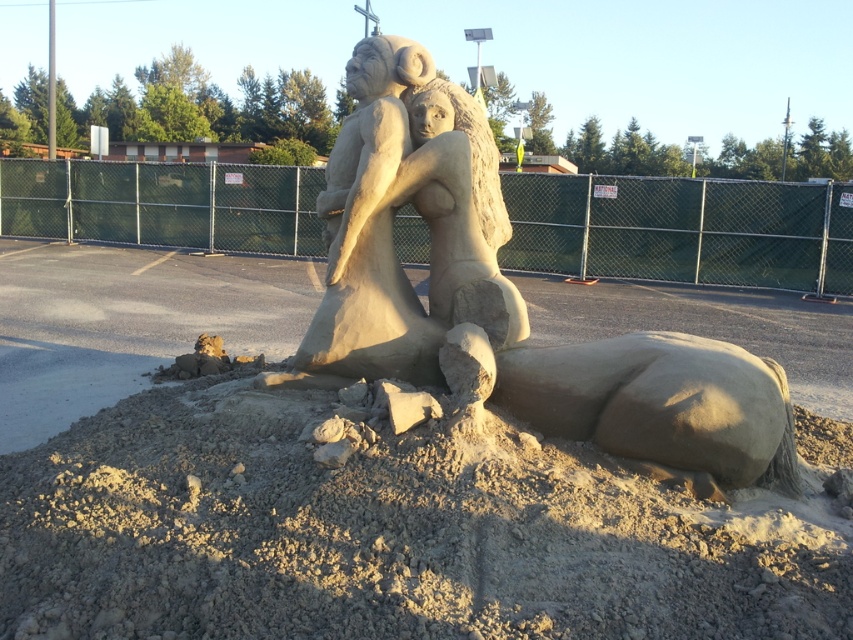
Question: Which of the following is the farthest from the observer?

Choices:
 (A) dry sand at center
 (B) sand sculpture at center
 (C) smooth sand sculpture at center

Answer: (C)

Question: Where is dry sand at center located in relation to smooth sand sculpture at center in the image?

Choices:
 (A) left
 (B) right

Answer: (A)

Question: Where is dry sand at center located in relation to smooth sand sculpture at center in the image?

Choices:
 (A) above
 (B) below

Answer: (B)

Question: Does dry sand at center appear under sand sculpture at center?

Choices:
 (A) yes
 (B) no

Answer: (A)

Question: Among these points, which one is farthest from the camera?

Choices:
 (A) (485, 461)
 (B) (469, 253)
 (C) (637, 346)

Answer: (B)

Question: Which object is farther from the camera taking this photo?

Choices:
 (A) smooth sand sculpture at center
 (B) dry sand at center
 (C) sand sculpture at center

Answer: (A)